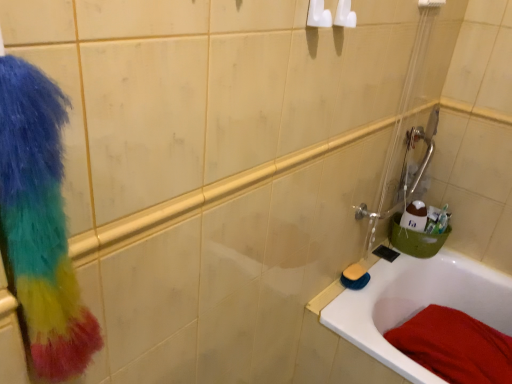
Question: Visually, is red cotton towel at lower right positioned to the left or to the right of yellow sponge at lower right?

Choices:
 (A) left
 (B) right

Answer: (B)

Question: Which is correct: red cotton towel at lower right is inside yellow sponge at lower right, or outside of it?

Choices:
 (A) outside
 (B) inside

Answer: (A)

Question: Which is farther from the multicolored fluffy scrub at left?

Choices:
 (A) yellow sponge at lower right
 (B) yellow sponge at lower right
 (C) white glossy bathtub at lower right
 (D) green plastic bucket at right
 (E) red cotton towel at lower right

Answer: (D)

Question: Estimate the real-world distances between objects in this image. Which object is closer to the green plastic bucket at right?

Choices:
 (A) yellow sponge at lower right
 (B) yellow sponge at lower right
 (C) multicolored fluffy scrub at left
 (D) white glossy bathtub at lower right
 (E) red cotton towel at lower right

Answer: (D)